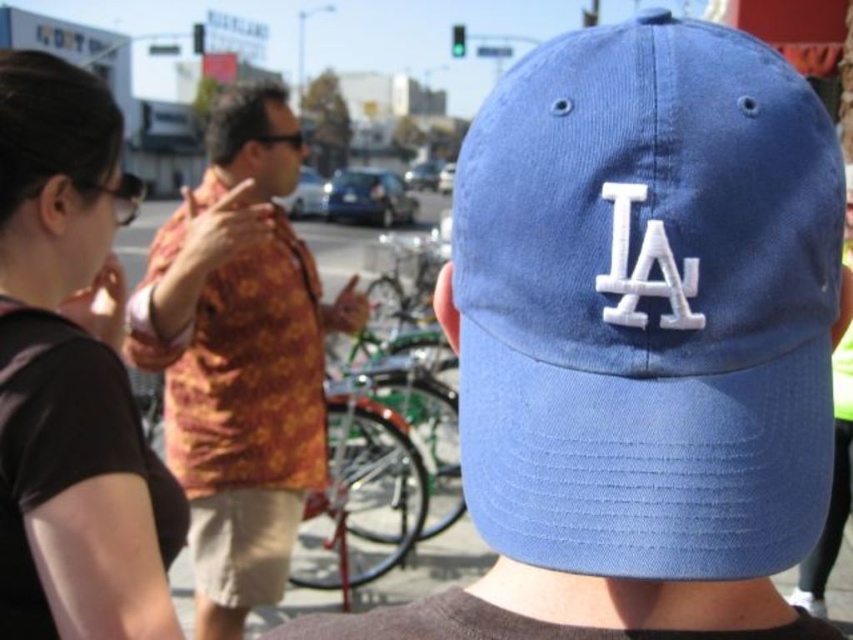
Question: Which of the following is the farthest from the observer?

Choices:
 (A) floral-patterned shirt at center
 (B) blue fabric baseball cap at center

Answer: (A)

Question: Does blue fabric baseball cap at center appear on the left side of matte blue cap at center?

Choices:
 (A) yes
 (B) no

Answer: (A)

Question: Considering the relative positions of blue fabric baseball cap at center and black fabric shirt at upper left in the image provided, where is blue fabric baseball cap at center located with respect to black fabric shirt at upper left?

Choices:
 (A) right
 (B) left

Answer: (A)

Question: Is blue fabric baseball cap at center below black fabric shirt at upper left?

Choices:
 (A) yes
 (B) no

Answer: (B)

Question: Which point is closer to the camera taking this photo?

Choices:
 (A) (175, 410)
 (B) (701, 504)
 (C) (840, 403)
 (D) (42, 388)

Answer: (B)

Question: Which object is positioned closest to the matte blue cap at center?

Choices:
 (A) blue fabric baseball cap at center
 (B) floral-patterned shirt at center
 (C) black fabric shirt at upper left

Answer: (B)